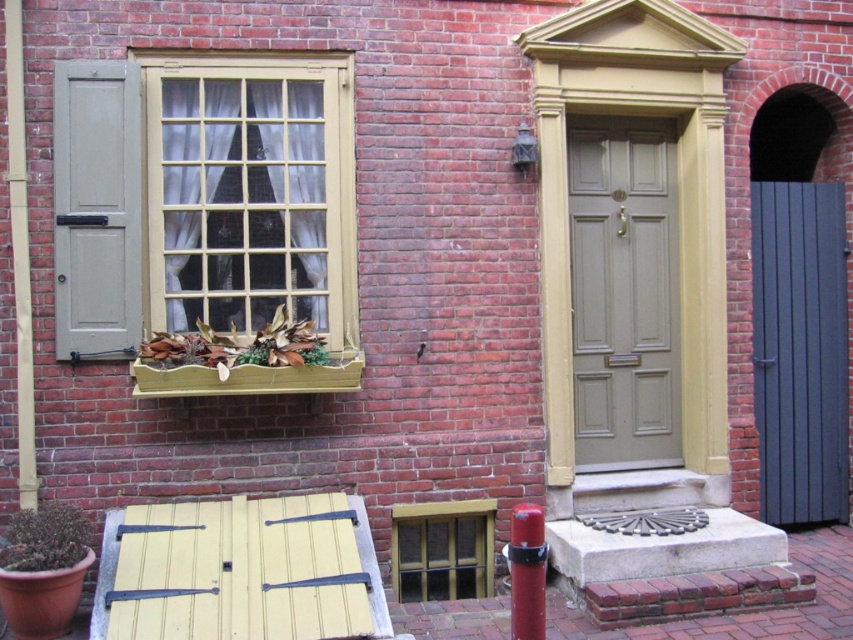
You are standing in front of the red brick building depicted in the image. You need to locate the matte black door at right. Based on the coordinates provided, can you determine if the door is closer to the top or bottom of the image?

The 2D location of the matte black door at right is at point (799, 349). Since the y coordinate is 0.939, which is closer to 1.0, the door is closer to the top of the image.

You are a gardener inspecting the plants in the window box. Which plant is smaller between the green matte plant at lower left and the brown leafy plant at lower left?

The green matte plant at lower left is smaller than the brown leafy plant at lower left.